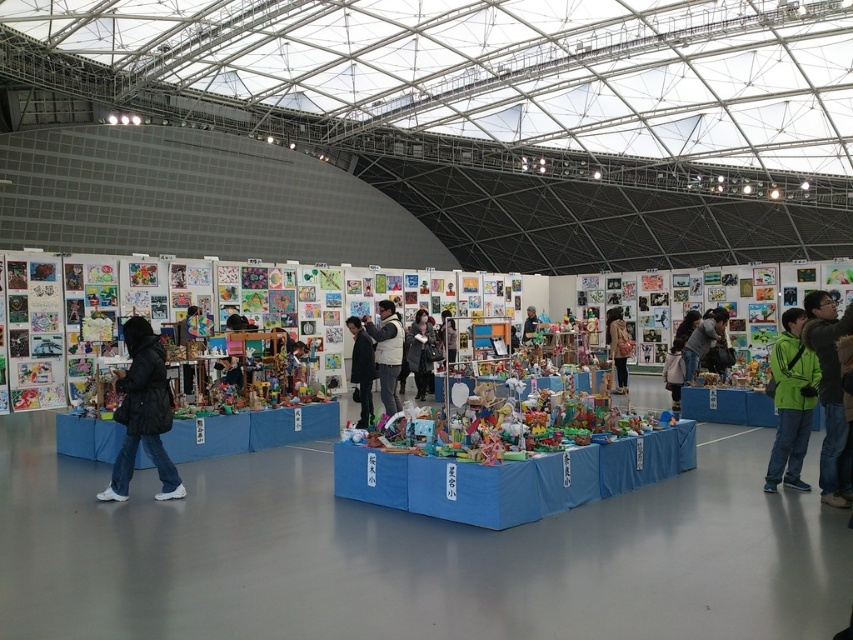
Question: Does dark gray jacket at center have a lesser width compared to matte black jacket at center?

Choices:
 (A) no
 (B) yes

Answer: (A)

Question: Which object is closer to the camera taking this photo?

Choices:
 (A) black matte jacket at lower left
 (B) green jacket at lower right

Answer: (B)

Question: Can you confirm if black fuzzy jacket at center is smaller than dark blue jacket at center?

Choices:
 (A) no
 (B) yes

Answer: (A)

Question: Which point is farther from the camera taking this photo?

Choices:
 (A) (527, 312)
 (B) (624, 342)
 (C) (393, 356)

Answer: (A)

Question: Is black fuzzy jacket at center wider than brown leather jacket at center?

Choices:
 (A) yes
 (B) no

Answer: (A)

Question: Estimate the real-world distances between objects in this image. Which object is closer to the green matte jacket at right?

Choices:
 (A) black matte jacket at lower left
 (B) dark blue jacket at center
 (C) black fuzzy jacket at center

Answer: (A)